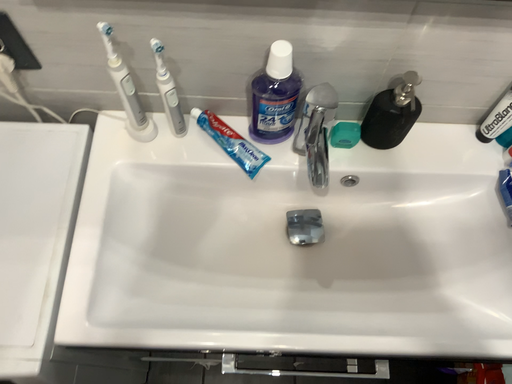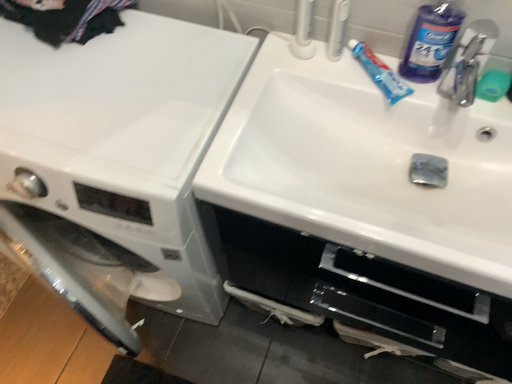
Question: How did the camera likely rotate when shooting the video?

Choices:
 (A) rotated left
 (B) rotated right

Answer: (A)